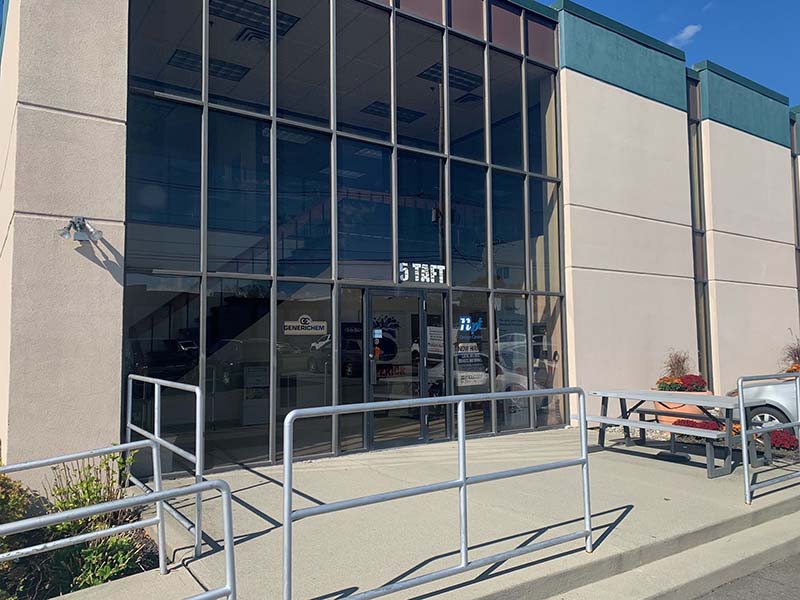
Find the location of a particular element. The image size is (800, 600). door is located at coordinates (404, 372).